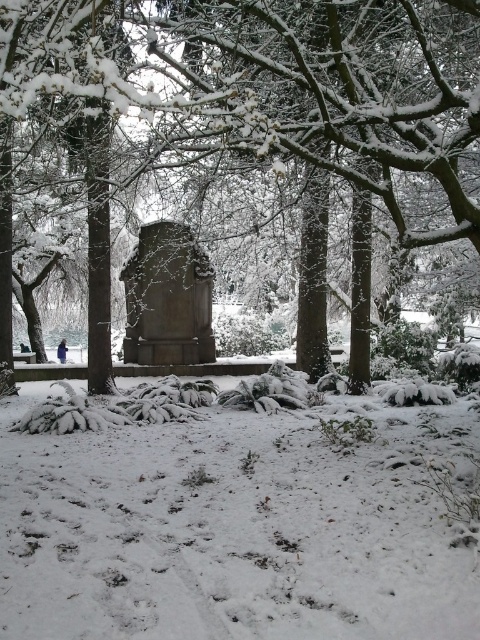
Is white fluffy snow at center taller than snow-covered stone monument at center?

Incorrect, white fluffy snow at center's height is not larger of snow-covered stone monument at center's.

Looking at this image, who is positioned more to the right, white fluffy snow at center or snow-covered stone monument at center?

snow-covered stone monument at center

At what (x,y) coordinates should I click in order to perform the action: click on white fluffy snow at center. Please return your answer as a coordinate pair (x, y). The image size is (480, 640). Looking at the image, I should click on (235, 529).

Is white fluffy snow at center thinner than granite tombstone at center?

Yes, white fluffy snow at center is thinner than granite tombstone at center.

Which is more to the left, white fluffy snow at center or granite tombstone at center?

granite tombstone at center is more to the left.

What do you see at coordinates (235, 529) in the screenshot?
I see `white fluffy snow at center` at bounding box center [235, 529].

The width and height of the screenshot is (480, 640). Identify the location of white fluffy snow at center. (235, 529).

Between snow-covered stone monument at center and granite tombstone at center, which one is positioned lower?

Positioned lower is granite tombstone at center.

Does snow-covered stone monument at center have a smaller size compared to granite tombstone at center?

Incorrect, snow-covered stone monument at center is not smaller in size than granite tombstone at center.

Describe the element at coordinates (277, 84) in the screenshot. This screenshot has width=480, height=640. I see `snow-covered stone monument at center` at that location.

The height and width of the screenshot is (640, 480). Identify the location of snow-covered stone monument at center. (277, 84).